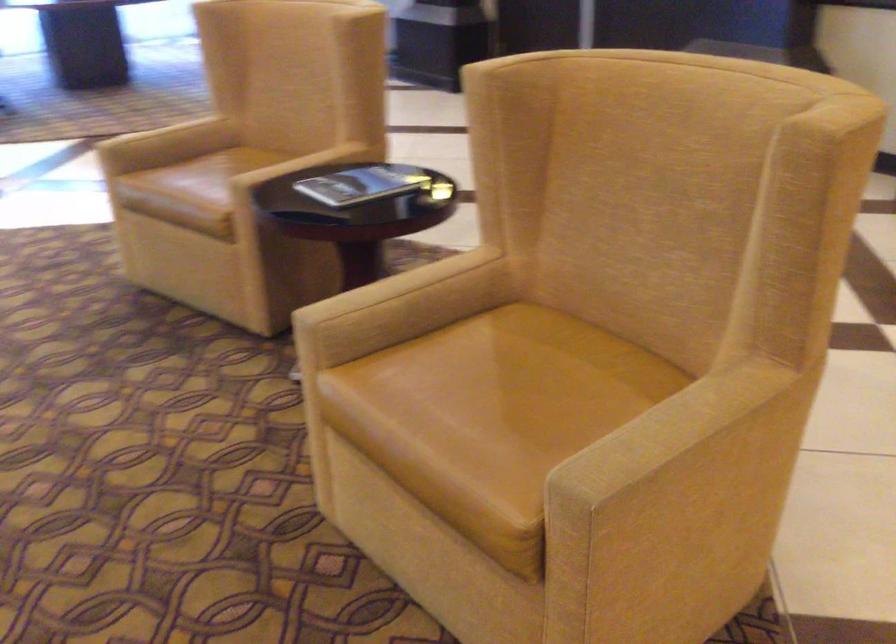
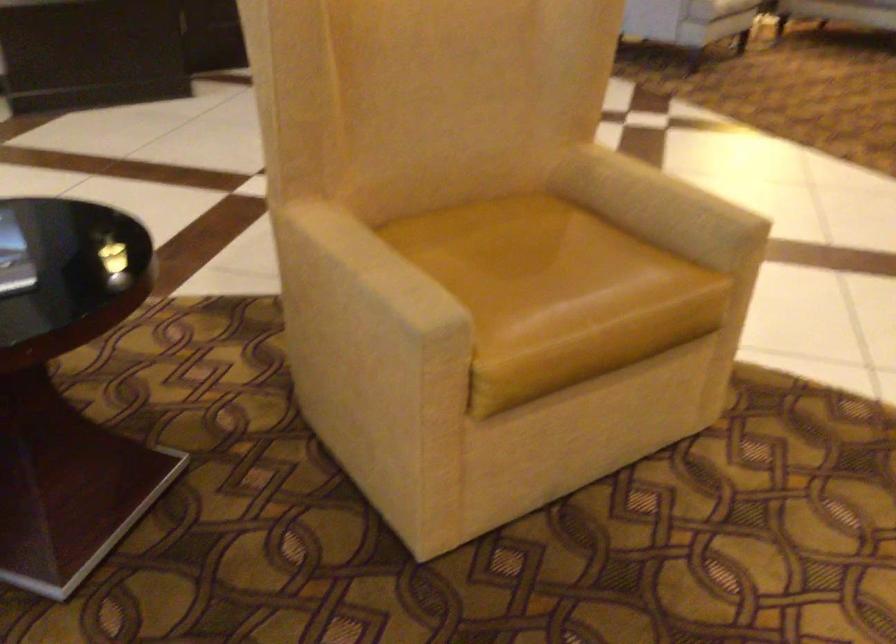
Where in the second image is the point corresponding to (521,377) from the first image?

(520, 256)